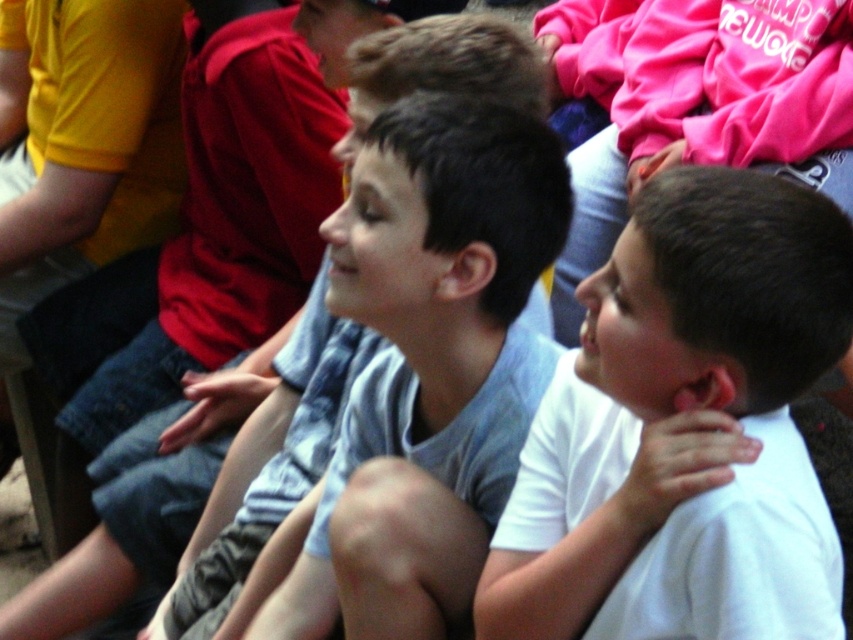
Question: Which point is closer to the camera?

Choices:
 (A) white matte shirt at center
 (B) gray cotton shirt at center

Answer: (A)

Question: Considering the relative positions of white matte shirt at center and gray cotton shirt at center in the image provided, where is white matte shirt at center located with respect to gray cotton shirt at center?

Choices:
 (A) above
 (B) below

Answer: (B)

Question: Which of the following is the closest to the observer?

Choices:
 (A) white matte shirt at center
 (B) gray cotton shirt at center

Answer: (A)

Question: Is white matte shirt at center below gray cotton shirt at center?

Choices:
 (A) yes
 (B) no

Answer: (A)

Question: Is white matte shirt at center wider than gray cotton shirt at center?

Choices:
 (A) yes
 (B) no

Answer: (B)